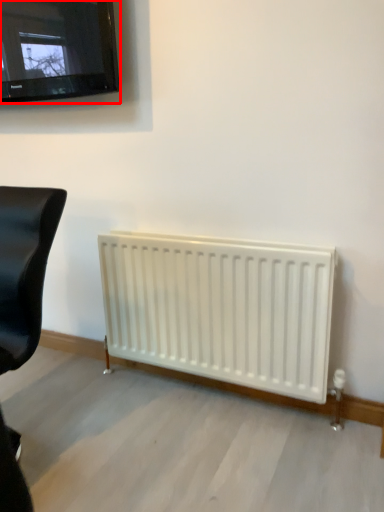
Question: From the image's perspective, what is the correct spatial relationship of television (annotated by the red box) in relation to furniture?

Choices:
 (A) above
 (B) below

Answer: (A)